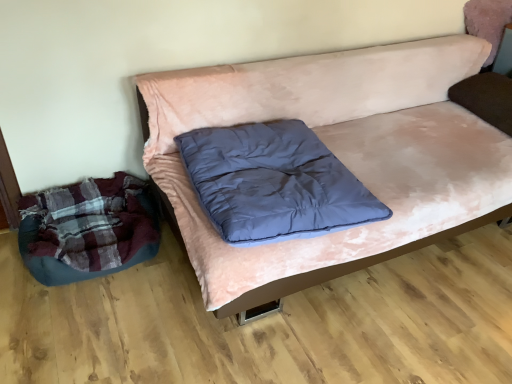
The height and width of the screenshot is (384, 512). I want to click on vacant space in front of plush dark blue bean bag at lower left, so click(79, 322).